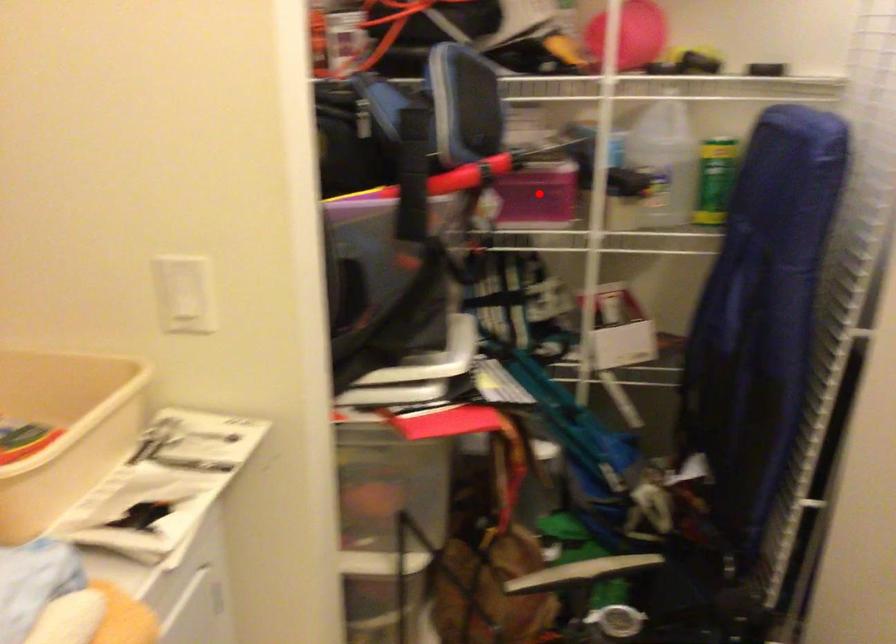
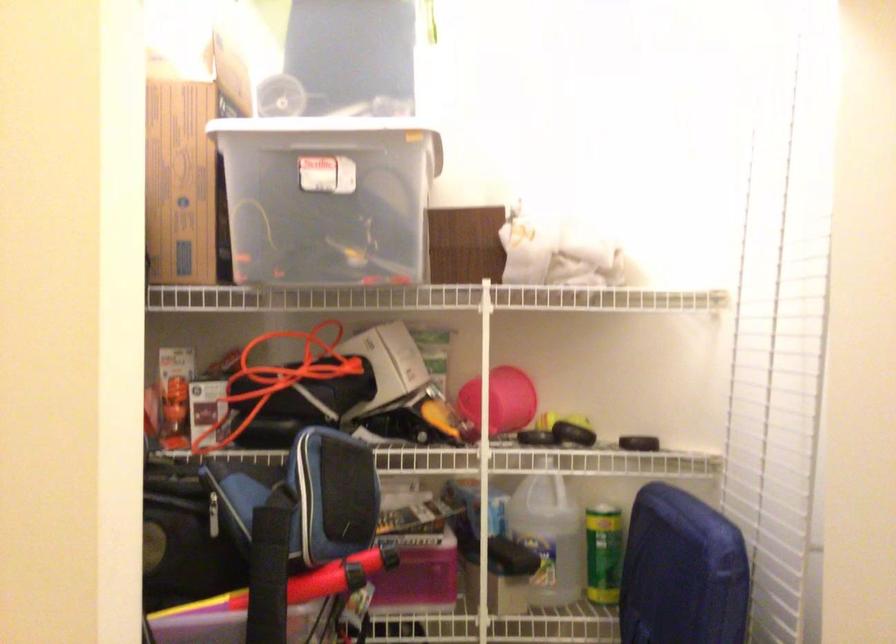
Locate, in the second image, the point that corresponds to the highlighted location in the first image.

(418, 574)